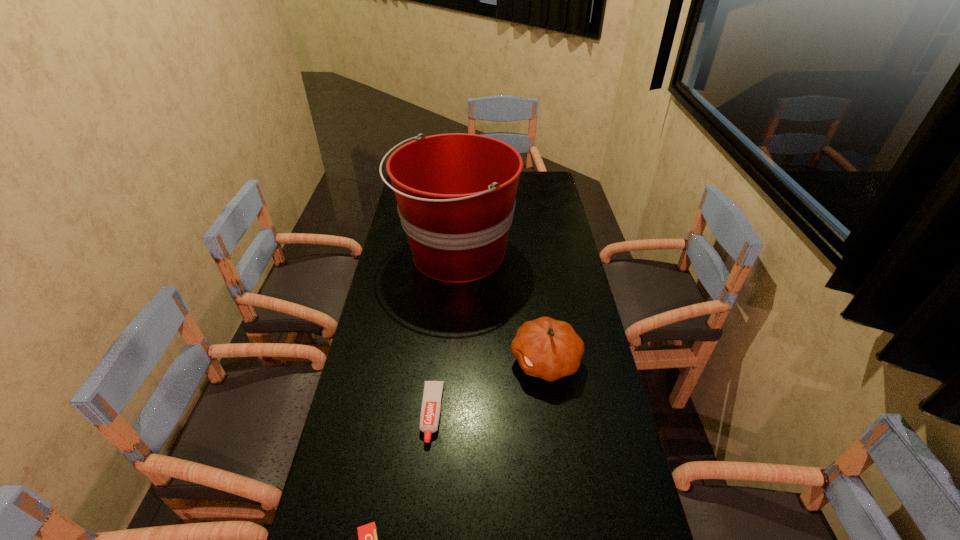
Where is `object situated at the left edge`? object situated at the left edge is located at coordinates (455, 192).

Identify the location of object that is at the right edge. The image size is (960, 540). (550, 349).

You are a GUI agent. You are given a task and a screenshot of the screen. Output one action in this format:
    pyautogui.click(x=<x>, y=<y>)
    Task: Click on the vacant region at the left edge of the desktop
    This screenshot has height=540, width=960.
    Given the screenshot: What is the action you would take?
    pyautogui.click(x=412, y=326)

In the image, there is a desktop. What are the coordinates of `free space at the right edge` in the screenshot? It's located at (546, 303).

I want to click on free space at the far right corner of the desktop, so click(556, 187).

What are the coordinates of `vacant point located between the third shortest object and the third tallest object` in the screenshot? It's located at (489, 387).

The image size is (960, 540). I want to click on free point between the second tallest object and the taller toothpaste, so click(x=489, y=387).

The width and height of the screenshot is (960, 540). In order to click on vacant region between the third shortest object and the taller toothpaste in this screenshot , I will do `click(489, 387)`.

Locate an element on the screen. The image size is (960, 540). object that is the third closest to the tallest object is located at coordinates (367, 534).

Choose which object is the nearest neighbor to the third tallest object. Please provide its 2D coordinates. Your answer should be formatted as a tuple, i.e. [(x, y)], where the tuple contains the x and y coordinates of a point satisfying the conditions above.

[(550, 349)]